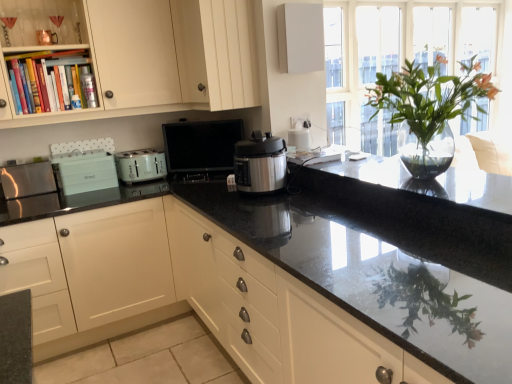
You are a GUI agent. You are given a task and a screenshot of the screen. Output one action in this format:
    pyautogui.click(x=<x>, y=<y>)
    Task: Click on the matte black microwave at center, which is the 3th appliance from left to right
    
    Given the screenshot: What is the action you would take?
    pyautogui.click(x=201, y=149)

This screenshot has width=512, height=384. What do you see at coordinates (429, 109) in the screenshot?
I see `clear glass vase at upper right` at bounding box center [429, 109].

You are a GUI agent. You are given a task and a screenshot of the screen. Output one action in this format:
    pyautogui.click(x=<x>, y=<y>)
    Task: Click on the clear glass vase at upper right
    This screenshot has width=512, height=384.
    Given the screenshot: What is the action you would take?
    pyautogui.click(x=429, y=109)

Image resolution: width=512 pixels, height=384 pixels. Describe the element at coordinates (216, 52) in the screenshot. I see `matte cream cabinet at upper center, the second cabinetry from the bottom` at that location.

What is the approximate height of brushed metal toaster at left, positioned as the first appliance in left-to-right order?

The height of brushed metal toaster at left, positioned as the first appliance in left-to-right order, is 9.28 inches.

What do you see at coordinates (424, 181) in the screenshot?
I see `black granite countertop at center, arranged as the second countertop when ordered from the bottom` at bounding box center [424, 181].

This screenshot has width=512, height=384. I want to click on stainless steel pressure cooker at center, so click(x=260, y=163).

Can matte green toaster at center be found inside stainless steel pressure cooker at center?

No, matte green toaster at center is not a part of stainless steel pressure cooker at center.

Who is shorter, stainless steel pressure cooker at center or matte green toaster at center?

With less height is matte green toaster at center.

Is stainless steel pressure cooker at center with matte green toaster at center?

No, stainless steel pressure cooker at center is not with matte green toaster at center.

The image size is (512, 384). What are the coordinates of `home appliance that appears below the matte green toaster at center (from the image's perspective)` in the screenshot? It's located at (260, 163).

Considering the positions of point (51, 172) and point (225, 168), is point (51, 172) closer or farther from the camera than point (225, 168)?

Point (51, 172) appears to be closer to the viewer than point (225, 168).

You are a GUI agent. You are given a task and a screenshot of the screen. Output one action in this format:
    pyautogui.click(x=<x>, y=<y>)
    Task: Click on the 2nd appliance to the left of the matte black microwave at center, which is the first appliance from right to left, counting from the anchor's position
    The height and width of the screenshot is (384, 512).
    Given the screenshot: What is the action you would take?
    pyautogui.click(x=27, y=180)

From a real-world perspective, which object rests below the other?

brushed metal toaster at left, positioned as the first appliance in left-to-right order, is physically lower.

Between brushed metal toaster at left, acting as the 3th appliance starting from the right, and matte black microwave at center, which is the 3th appliance from left to right, which one has smaller size?

With smaller size is brushed metal toaster at left, acting as the 3th appliance starting from the right.

From the image's perspective, is matte teal toaster at left, which is counted as the 2th appliance, starting from the left, located above or below black granite countertop at center, which is the first countertop from bottom to top?

matte teal toaster at left, which is counted as the 2th appliance, starting from the left, is situated higher than black granite countertop at center, which is the first countertop from bottom to top, in the image.

From a real-world perspective, which is physically below, matte teal toaster at left, positioned as the 2th appliance in right-to-left order, or black granite countertop at center, which is the first countertop from bottom to top?

From a 3D spatial view, black granite countertop at center, which is the first countertop from bottom to top, is below.

What's the angular difference between matte teal toaster at left, which is counted as the 2th appliance, starting from the left, and black granite countertop at center, which is the first countertop from bottom to top,'s facing directions?

The angular difference between matte teal toaster at left, which is counted as the 2th appliance, starting from the left, and black granite countertop at center, which is the first countertop from bottom to top, is 90 degrees.

Is point (72, 168) closer or farther from the camera than point (503, 358)?

Point (72, 168) appears to be farther away from the viewer than point (503, 358).

You are a GUI agent. You are given a task and a screenshot of the screen. Output one action in this format:
    pyautogui.click(x=<x>, y=<y>)
    Task: Click on the houseplant on the right of black granite countertop at center, which ranks as the 1th countertop in top-to-bottom order
    This screenshot has height=384, width=512.
    Given the screenshot: What is the action you would take?
    pyautogui.click(x=429, y=109)

Considering the sizes of black granite countertop at center, which ranks as the 1th countertop in top-to-bottom order, and clear glass vase at upper right in the image, is black granite countertop at center, which ranks as the 1th countertop in top-to-bottom order, bigger or smaller than clear glass vase at upper right?

Clearly, black granite countertop at center, which ranks as the 1th countertop in top-to-bottom order, is smaller in size than clear glass vase at upper right.

Is black granite countertop at center, arranged as the second countertop when ordered from the bottom, completely or partially outside of clear glass vase at upper right?

Yes, black granite countertop at center, arranged as the second countertop when ordered from the bottom, is located beyond the bounds of clear glass vase at upper right.

Are black granite countertop at center, which ranks as the 1th countertop in top-to-bottom order, and clear glass vase at upper right far apart?

That's right, there is a large distance between black granite countertop at center, which ranks as the 1th countertop in top-to-bottom order, and clear glass vase at upper right.

Does matte cream cabinet at upper center, arranged as the 1th cabinetry when viewed from the top, have a larger size compared to matte black microwave at center, which is the 3th appliance from left to right?

Indeed, matte cream cabinet at upper center, arranged as the 1th cabinetry when viewed from the top, has a larger size compared to matte black microwave at center, which is the 3th appliance from left to right.

Based on the photo, how many degrees apart are the facing directions of matte cream cabinet at upper center, arranged as the 1th cabinetry when viewed from the top, and matte black microwave at center, which is the 3th appliance from left to right?

They differ by 51.9 degrees in their facing directions.

Choose the correct answer: Is matte cream cabinet at upper center, the second cabinetry from the bottom, inside matte black microwave at center, which is the 3th appliance from left to right, or outside it?

matte cream cabinet at upper center, the second cabinetry from the bottom, is spatially situated outside matte black microwave at center, which is the 3th appliance from left to right.

From the image's perspective, between matte cream cabinet at upper center, the second cabinetry from the bottom, and matte black microwave at center, which is the 3th appliance from left to right, who is located below?

matte black microwave at center, which is the 3th appliance from left to right, appears lower in the image.

Is matte black microwave at center, which is the first appliance from right to left, inside or outside of clear glass vase at upper right?

matte black microwave at center, which is the first appliance from right to left, is not inside clear glass vase at upper right, it's outside.

Is matte black microwave at center, which is the first appliance from right to left, directly adjacent to clear glass vase at upper right?

No, matte black microwave at center, which is the first appliance from right to left, is not next to clear glass vase at upper right.

Find the location of a particular element. The height and width of the screenshot is (384, 512). houseplant that is above the matte black microwave at center, which is the 3th appliance from left to right (from a real-world perspective) is located at coordinates (429, 109).

From the picture: Could you measure the distance between matte teal toaster at left, positioned as the 2th appliance in right-to-left order, and matte cream cabinet at upper center, the second cabinetry from the bottom?

matte teal toaster at left, positioned as the 2th appliance in right-to-left order, and matte cream cabinet at upper center, the second cabinetry from the bottom, are 35.97 inches apart from each other.

Which is more to the right, matte teal toaster at left, positioned as the 2th appliance in right-to-left order, or matte cream cabinet at upper center, arranged as the 1th cabinetry when viewed from the top?

matte cream cabinet at upper center, arranged as the 1th cabinetry when viewed from the top, is more to the right.

Can you confirm if matte teal toaster at left, positioned as the 2th appliance in right-to-left order, is wider than matte cream cabinet at upper center, arranged as the 1th cabinetry when viewed from the top?

No.

Identify the location of cabinetry above the matte teal toaster at left, positioned as the 2th appliance in right-to-left order (from a real-world perspective). (216, 52).

Locate an element on the screen. The width and height of the screenshot is (512, 384). home appliance that appears below the matte green toaster at center (from the image's perspective) is located at coordinates (260, 163).

The height and width of the screenshot is (384, 512). I want to click on appliance behind the brushed metal toaster at left, positioned as the first appliance in left-to-right order, so click(x=201, y=149).

Estimate the real-world distances between objects in this image. Which object is further from matte cream cabinet at upper center, the second cabinetry from the bottom, brushed metal toaster at left, acting as the 3th appliance starting from the right, or matte white cabinet at center, which is counted as the 1th cabinetry, starting from the bottom?

brushed metal toaster at left, acting as the 3th appliance starting from the right, lies further to matte cream cabinet at upper center, the second cabinetry from the bottom, than the other object.

Based on their spatial positions, is matte cream cabinet at upper center, the second cabinetry from the bottom, or brushed metal toaster at left, acting as the 3th appliance starting from the right, further from matte black microwave at center, which is the 3th appliance from left to right?

The object further to matte black microwave at center, which is the 3th appliance from left to right, is brushed metal toaster at left, acting as the 3th appliance starting from the right.

Which object lies nearer to the anchor point matte teal toaster at left, which is counted as the 2th appliance, starting from the left, matte black microwave at center, which is the first appliance from right to left, or black granite countertop at center, arranged as the second countertop when ordered from the bottom?

The object closer to matte teal toaster at left, which is counted as the 2th appliance, starting from the left, is matte black microwave at center, which is the first appliance from right to left.

Based on their spatial positions, is stainless steel pressure cooker at center or brushed metal toaster at left, positioned as the first appliance in left-to-right order, closer to matte white cabinet at center, which is counted as the 1th cabinetry, starting from the bottom?

brushed metal toaster at left, positioned as the first appliance in left-to-right order.

Estimate the real-world distances between objects in this image. Which object is further from clear glass vase at upper right, black granite countertop at center, which ranks as the 1th countertop in top-to-bottom order, or matte cream cabinet at upper center, the second cabinetry from the bottom?

Based on the image, black granite countertop at center, which ranks as the 1th countertop in top-to-bottom order, appears to be further to clear glass vase at upper right.

Considering their positions, is brushed metal toaster at left, acting as the 3th appliance starting from the right, positioned closer to black granite countertop at center, arranged as the second countertop when ordered from the bottom, than matte teal toaster at left, positioned as the 2th appliance in right-to-left order?

The object closer to black granite countertop at center, arranged as the second countertop when ordered from the bottom, is matte teal toaster at left, positioned as the 2th appliance in right-to-left order.

Based on their spatial positions, is black granite countertop at center, which ranks as the 1th countertop in top-to-bottom order, or matte teal toaster at left, positioned as the 2th appliance in right-to-left order, further from brushed metal toaster at left, acting as the 3th appliance starting from the right?

black granite countertop at center, which ranks as the 1th countertop in top-to-bottom order, lies further to brushed metal toaster at left, acting as the 3th appliance starting from the right, than the other object.

Considering their positions, is matte white cabinet at center, which is counted as the 1th cabinetry, starting from the bottom, positioned closer to black granite countertop at center, which is the first countertop from bottom to top, than brushed metal toaster at left, positioned as the first appliance in left-to-right order?

Among the two, matte white cabinet at center, which is counted as the 1th cabinetry, starting from the bottom, is located nearer to black granite countertop at center, which is the first countertop from bottom to top.

Locate an element on the screen. home appliance located between black granite countertop at center, which is the first countertop from bottom to top, and matte cream cabinet at upper center, the second cabinetry from the bottom, in the depth direction is located at coordinates [260, 163].

Where is `appliance situated between brushed metal toaster at left, positioned as the first appliance in left-to-right order, and matte white cabinet at center, arranged as the second cabinetry when viewed from the top, from left to right`? The width and height of the screenshot is (512, 384). appliance situated between brushed metal toaster at left, positioned as the first appliance in left-to-right order, and matte white cabinet at center, arranged as the second cabinetry when viewed from the top, from left to right is located at coordinates (84, 171).

Where is `cabinetry between matte green toaster at center and stainless steel pressure cooker at center from left to right`? The width and height of the screenshot is (512, 384). cabinetry between matte green toaster at center and stainless steel pressure cooker at center from left to right is located at coordinates (216, 52).

The height and width of the screenshot is (384, 512). What are the coordinates of `home appliance located between matte cream cabinet at upper center, the second cabinetry from the bottom, and clear glass vase at upper right in the left-right direction` in the screenshot? It's located at (260, 163).